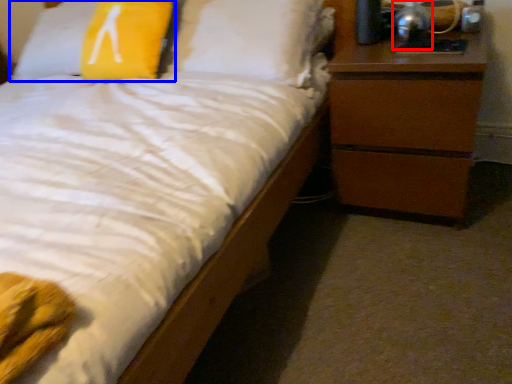
Question: Which of the following is the farthest to the observer, bedside lamp (highlighted by a red box) or pillow (highlighted by a blue box)?

Choices:
 (A) bedside lamp
 (B) pillow

Answer: (B)